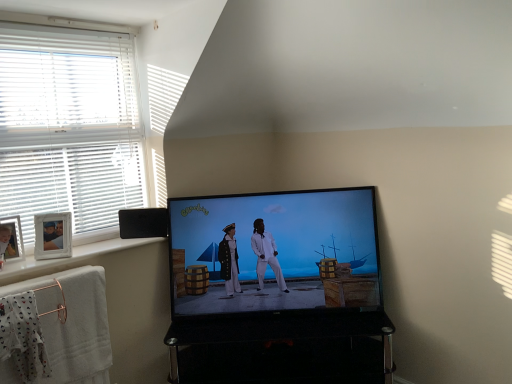
Question: Considering the relative sizes of white blinds at left and black glossy tv stand at lower center in the image provided, is white blinds at left shorter than black glossy tv stand at lower center?

Choices:
 (A) no
 (B) yes

Answer: (A)

Question: Does white blinds at left have a greater height compared to black glossy tv stand at lower center?

Choices:
 (A) yes
 (B) no

Answer: (A)

Question: Does white blinds at left have a smaller size compared to black glossy tv stand at lower center?

Choices:
 (A) no
 (B) yes

Answer: (B)

Question: Would you say black glossy tv stand at lower center is part of white blinds at left's contents?

Choices:
 (A) no
 (B) yes

Answer: (A)

Question: From the image's perspective, is white blinds at left located beneath black glossy tv stand at lower center?

Choices:
 (A) no
 (B) yes

Answer: (A)

Question: Is white blinds at left further to camera compared to black glossy tv stand at lower center?

Choices:
 (A) yes
 (B) no

Answer: (B)

Question: Is white cotton bath towel at lower left positioned in front of shiny black screen at center?

Choices:
 (A) no
 (B) yes

Answer: (B)

Question: Is white cotton bath towel at lower left touching shiny black screen at center?

Choices:
 (A) no
 (B) yes

Answer: (A)

Question: Is white cotton bath towel at lower left further to camera compared to shiny black screen at center?

Choices:
 (A) no
 (B) yes

Answer: (A)

Question: Can you confirm if white cotton bath towel at lower left is shorter than shiny black screen at center?

Choices:
 (A) yes
 (B) no

Answer: (A)

Question: Is shiny black screen at center located within white cotton bath towel at lower left?

Choices:
 (A) no
 (B) yes

Answer: (A)

Question: From the image's perspective, is white cotton bath towel at lower left on shiny black screen at center?

Choices:
 (A) no
 (B) yes

Answer: (A)

Question: From a real-world perspective, does shiny black screen at center sit lower than white blinds at left?

Choices:
 (A) yes
 (B) no

Answer: (A)